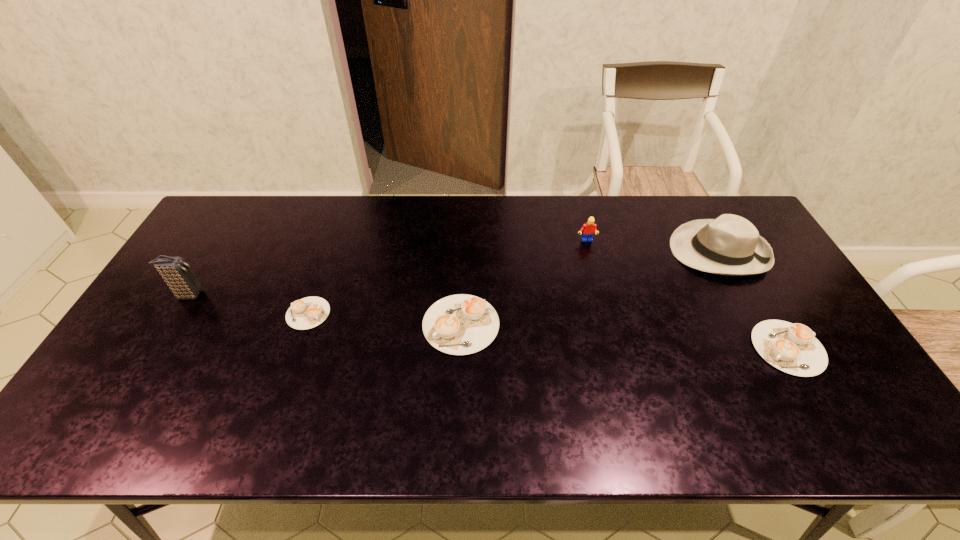
Locate an element on the screen. free point between the Lego and the fifth tallest object is located at coordinates (686, 294).

You are a GUI agent. You are given a task and a screenshot of the screen. Output one action in this format:
    pyautogui.click(x=<x>, y=<y>)
    Task: Click on the free spot between the third object from right to left and the second cappuccino from left to right
    This screenshot has height=540, width=960.
    Given the screenshot: What is the action you would take?
    pyautogui.click(x=523, y=283)

The image size is (960, 540). Find the location of `free spot between the second cappuccino from right to left and the rightmost cappuccino`. free spot between the second cappuccino from right to left and the rightmost cappuccino is located at coordinates (624, 336).

Find the location of a particular element. This screenshot has height=540, width=960. free space between the Lego and the second cappuccino from left to right is located at coordinates (523, 283).

Image resolution: width=960 pixels, height=540 pixels. I want to click on free area in between the second object from left to right and the clutch bag, so click(249, 304).

Image resolution: width=960 pixels, height=540 pixels. In order to click on object identified as the closest to the second tallest cappuccino in this screenshot , I will do `click(730, 245)`.

Choose which object is the second nearest neighbor to the tallest object. Please provide its 2D coordinates. Your answer should be formatted as a tuple, i.e. [(x, y)], where the tuple contains the x and y coordinates of a point satisfying the conditions above.

[(461, 324)]

At what (x,y) coordinates should I click in order to perform the action: click on the third closest cappuccino to the Lego. Please return your answer as a coordinate pair (x, y). Looking at the image, I should click on (309, 312).

I want to click on the closest cappuccino to the second shortest cappuccino, so click(461, 324).

The width and height of the screenshot is (960, 540). Find the location of `free location that satisfies the following two spatial constraints: 1. with the zip open on the tallest object; 2. on the left side of the second cappuccino from right to left`. free location that satisfies the following two spatial constraints: 1. with the zip open on the tallest object; 2. on the left side of the second cappuccino from right to left is located at coordinates (170, 325).